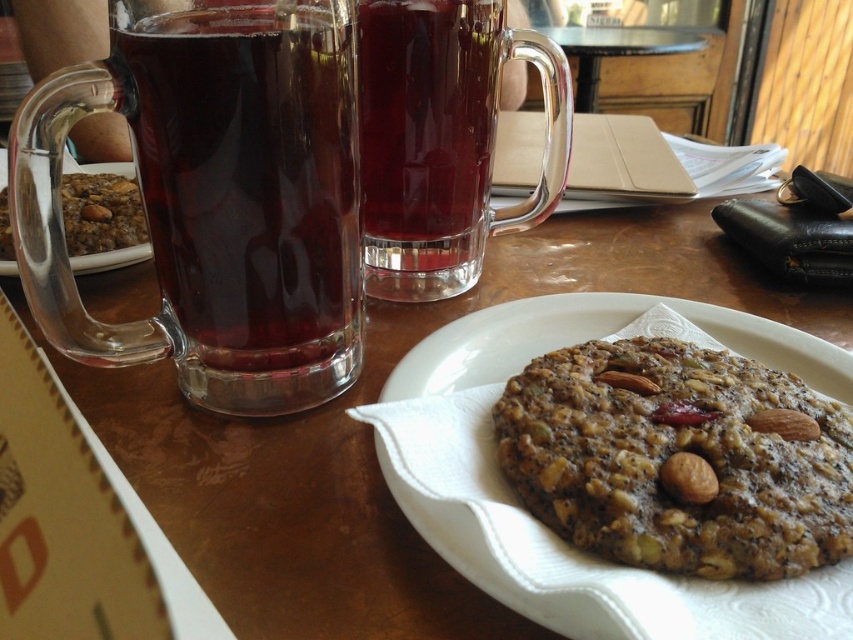
Between crumbly oatmeal cookie at center and brown textured almond at center-right, which one is positioned lower?

brown textured almond at center-right is lower down.

Is point (9, 216) positioned after point (761, 410)?

Yes.

Identify the location of crumbly oatmeal cookie at center. (102, 212).

Who is more forward, (141, 204) or (643, 385)?

Point (643, 385) is more forward.

What do you see at coordinates (102, 212) in the screenshot? The width and height of the screenshot is (853, 640). I see `crumbly oatmeal cookie at center` at bounding box center [102, 212].

What do you see at coordinates (102, 212) in the screenshot? This screenshot has height=640, width=853. I see `crumbly oatmeal cookie at center` at bounding box center [102, 212].

Where is `crumbly oatmeal cookie at center`? The height and width of the screenshot is (640, 853). crumbly oatmeal cookie at center is located at coordinates (102, 212).

Describe the element at coordinates (373, 438) in the screenshot. The height and width of the screenshot is (640, 853). I see `transparent glass mug at upper left` at that location.

What do you see at coordinates (373, 438) in the screenshot? Image resolution: width=853 pixels, height=640 pixels. I see `transparent glass mug at upper left` at bounding box center [373, 438].

Locate an element on the screen. The image size is (853, 640). transparent glass mug at upper left is located at coordinates (373, 438).